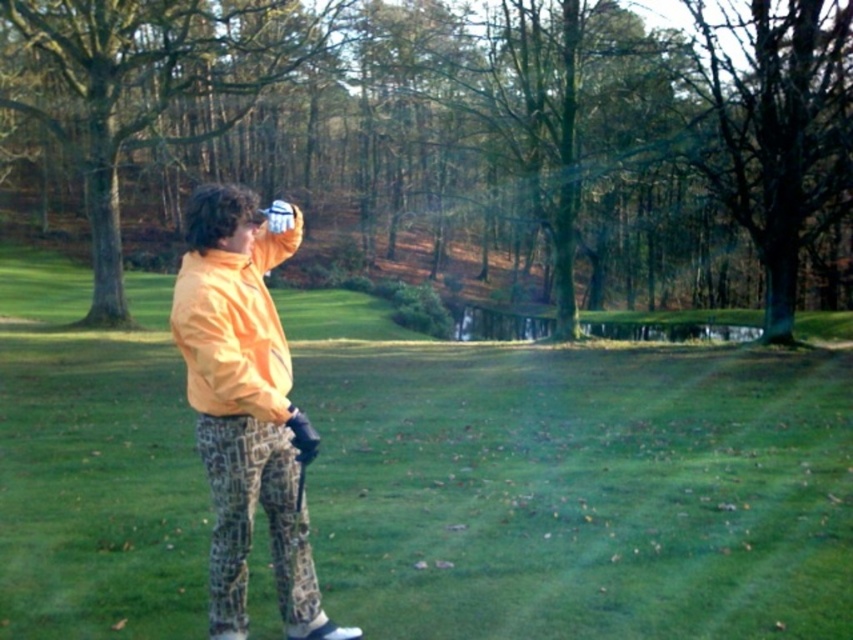
Is orange fabric jacket at center above green leafy tree at left?

No, orange fabric jacket at center is not above green leafy tree at left.

Is the position of orange fabric jacket at center more distant than that of green leafy tree at left?

No.

Find the location of `orange fabric jacket at center`. orange fabric jacket at center is located at coordinates (245, 406).

In the scene shown: Between green leafy tree at center and orange fabric jacket at center, which one is positioned lower?

orange fabric jacket at center is below.

Is green leafy tree at center smaller than orange fabric jacket at center?

Incorrect, green leafy tree at center is not smaller in size than orange fabric jacket at center.

What do you see at coordinates (457, 136) in the screenshot? The image size is (853, 640). I see `green leafy tree at center` at bounding box center [457, 136].

Where is `green leafy tree at center`? green leafy tree at center is located at coordinates (457, 136).

Between green leafy tree at center and green leafy tree at left, which one has more height?

With more height is green leafy tree at center.

From the picture: Who is more forward, (x=521, y=51) or (x=100, y=236)?

Point (x=100, y=236) is more forward.

I want to click on green leafy tree at center, so click(457, 136).